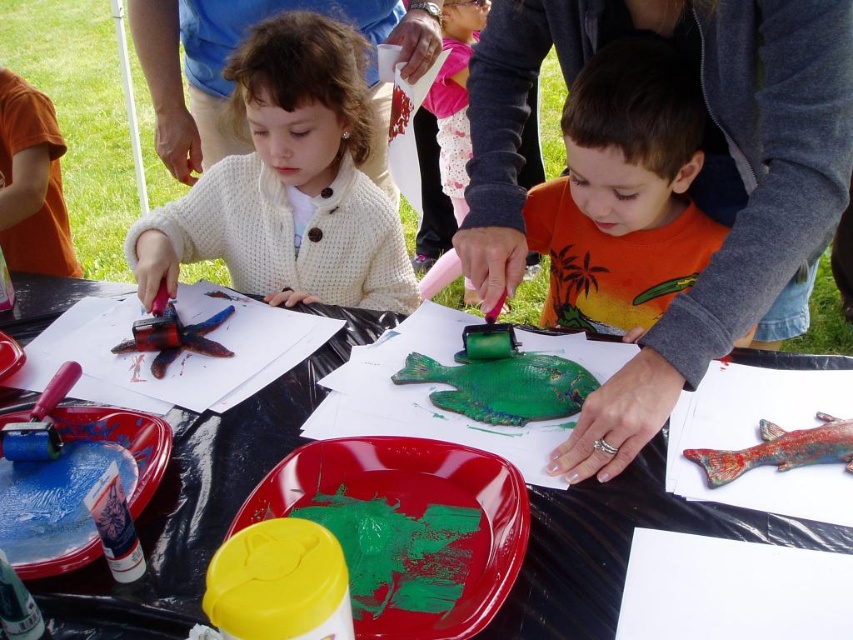
Question: Does green matte paint at center lie behind green matte fish at center?

Choices:
 (A) no
 (B) yes

Answer: (A)

Question: Which point is closer to the camera taking this photo?

Choices:
 (A) (556, 388)
 (B) (140, 488)
 (C) (450, 490)
 (D) (730, 468)

Answer: (B)

Question: Which point is closer to the camera taking this photo?

Choices:
 (A) (613, 518)
 (B) (271, 196)

Answer: (A)

Question: Is green matte paint at center positioned in front of green matte fish at center?

Choices:
 (A) no
 (B) yes

Answer: (B)

Question: Among these objects, which one is nearest to the camera?

Choices:
 (A) rubber stamp at upper left
 (B) matte white sweater at center

Answer: (A)

Question: Does blue plastic plate at lower left appear on the left side of green matte fish at center?

Choices:
 (A) yes
 (B) no

Answer: (A)